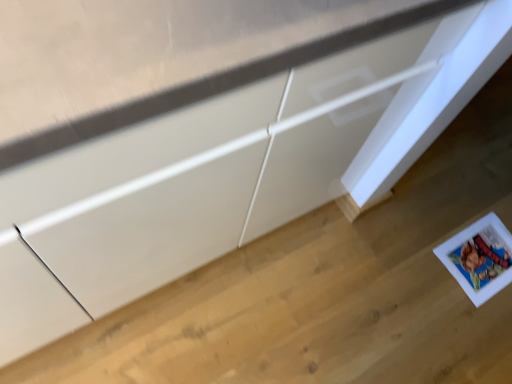
From the picture: What is the approximate width of white paper postcard at lower right?

white paper postcard at lower right is 12.01 inches wide.

Describe the element at coordinates (479, 258) in the screenshot. I see `white paper postcard at lower right` at that location.

Image resolution: width=512 pixels, height=384 pixels. I want to click on white paper postcard at lower right, so click(x=479, y=258).

What is the approximate height of white paper postcard at lower right?

white paper postcard at lower right is 0.91 inches in height.

You are a GUI agent. You are given a task and a screenshot of the screen. Output one action in this format:
    pyautogui.click(x=<x>, y=<y>)
    Task: Click on the white paper postcard at lower right
    The height and width of the screenshot is (384, 512).
    Given the screenshot: What is the action you would take?
    pyautogui.click(x=479, y=258)